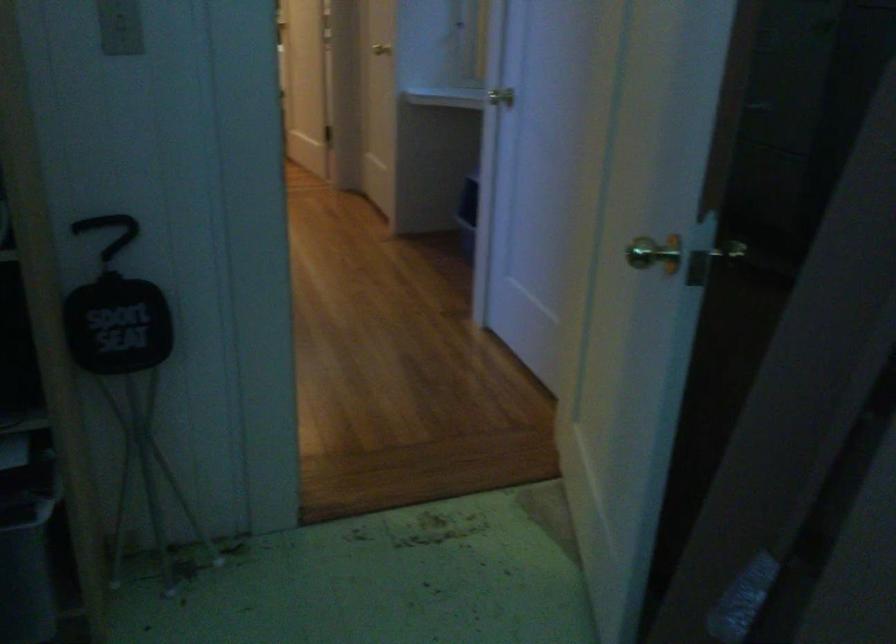
The height and width of the screenshot is (644, 896). Identify the location of light switch. (119, 26).